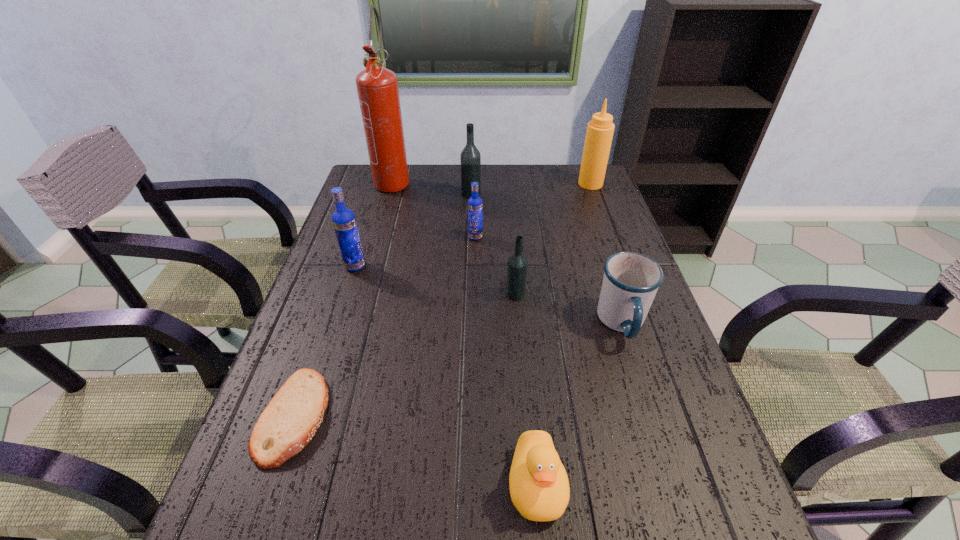
I want to click on free spot located on the front of the third nearest vodka, so click(x=474, y=349).

Find the location of a particular element. This screenshot has height=540, width=960. blank space located 0.270m on the left of the rightmost vodka is located at coordinates (400, 294).

Image resolution: width=960 pixels, height=540 pixels. What are the coordinates of `vacant space situated 0.090m on the handle side of the white mug` in the screenshot? It's located at (643, 387).

You are a GUI agent. You are given a task and a screenshot of the screen. Output one action in this format:
    pyautogui.click(x=<x>, y=<y>)
    Task: Click on the vacant space positioned 0.390m on the right of the shortest object
    
    Given the screenshot: What is the action you would take?
    pos(522,416)

You are a GUI agent. You are given a task and a screenshot of the screen. Output one action in this format:
    pyautogui.click(x=<x>, y=<y>)
    Task: Click on the fire extinguisher positioned at the far edge
    
    Given the screenshot: What is the action you would take?
    pyautogui.click(x=377, y=87)

The image size is (960, 540). What are the coordinates of `condiment located in the far edge section of the desktop` in the screenshot? It's located at (599, 134).

The width and height of the screenshot is (960, 540). What are the coordinates of `vodka that is positioned at the far edge` in the screenshot? It's located at (470, 158).

Where is `fire extinguisher that is at the left edge`? fire extinguisher that is at the left edge is located at coordinates (377, 87).

Find the location of a particular element. This screenshot has width=960, height=540. vodka present at the left edge is located at coordinates (344, 222).

At what (x,y) coordinates should I click in order to perform the action: click on pita bread that is positioned at the left edge. Please return your answer as a coordinate pair (x, y). Image resolution: width=960 pixels, height=540 pixels. Looking at the image, I should click on (290, 420).